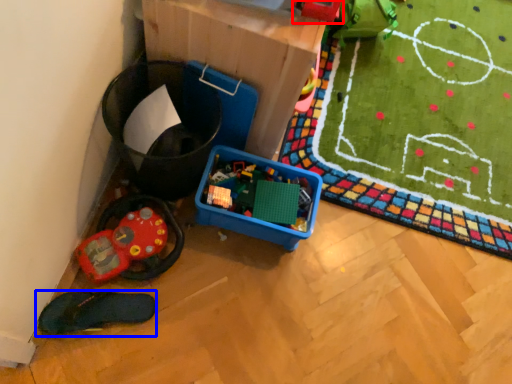
Question: Which of the following is the closest to the observer, toy (highlighted by a red box) or footwear (highlighted by a blue box)?

Choices:
 (A) toy
 (B) footwear

Answer: (A)